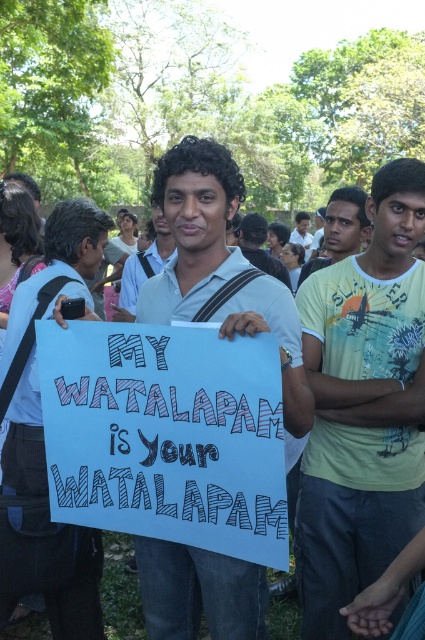
Consider the image. Who is higher up, white paper sign at left or white cotton shirt at center?

white cotton shirt at center is higher up.

Which is in front, point (44, 483) or point (153, 241)?

Point (44, 483) is in front.

Which is behind, point (28, 394) or point (158, 250)?

The point (158, 250) is more distant.

Image resolution: width=425 pixels, height=640 pixels. What are the coordinates of `white paper sign at left` in the screenshot? It's located at (42, 529).

Which is behind, point (345, 532) or point (33, 300)?

The point (33, 300) is more distant.

At what (x,y) coordinates should I click in order to perform the action: click on yellow printed t-shirt at right. Please return your answer as a coordinate pair (x, y). Looking at the image, I should click on (362, 406).

I want to click on yellow printed t-shirt at right, so click(x=362, y=406).

Does yellow printed t-shirt at right come behind light green t-shirt at center?

That is False.

Between point (311, 493) and point (337, 211), which one is positioned behind?

Positioned behind is point (337, 211).

Does point (303, 339) come farther from viewer compared to point (325, 232)?

No, it is in front of (325, 232).

You are a GUI agent. You are given a task and a screenshot of the screen. Output one action in this format:
    pyautogui.click(x=<x>, y=<y>)
    Task: Click on the yellow printed t-shirt at right
    Image resolution: width=425 pixels, height=640 pixels.
    Given the screenshot: What is the action you would take?
    pyautogui.click(x=362, y=406)